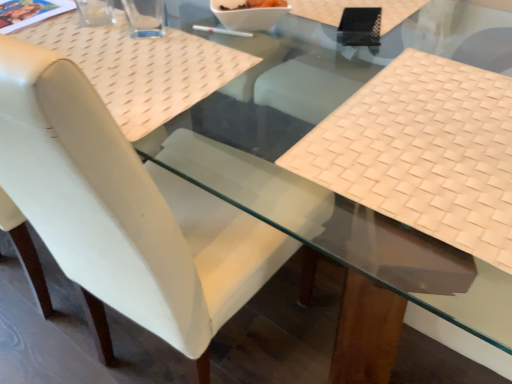
The height and width of the screenshot is (384, 512). Describe the element at coordinates (124, 212) in the screenshot. I see `white leather chair at center` at that location.

The image size is (512, 384). In order to click on transparent glass cup at upper left, the second clear positioned from the right in this screenshot , I will do `click(95, 12)`.

What is the approximate width of beige woven mat at right?

13.31 inches.

You are a GUI agent. You are given a task and a screenshot of the screen. Output one action in this format:
    pyautogui.click(x=<x>, y=<y>)
    Task: Click on the white glossy bowl at center
    The height and width of the screenshot is (384, 512).
    Given the screenshot: What is the action you would take?
    pyautogui.click(x=249, y=13)

Is transparent glass at upper left, the first clear when ordered from right to left, a part of white glossy bowl at center?

Definitely not — transparent glass at upper left, the first clear when ordered from right to left, is not inside white glossy bowl at center.

Looking at this image, are white glossy bowl at center and transparent glass at upper left, the first clear when ordered from right to left, far apart?

No, there isn't a large distance between white glossy bowl at center and transparent glass at upper left, the first clear when ordered from right to left.

Which object is closer to the camera, white glossy bowl at center or transparent glass at upper left, the 2th clear when ordered from left to right?

transparent glass at upper left, the 2th clear when ordered from left to right.

From a real-world perspective, is white glossy bowl at center physically below transparent glass at upper left, the 2th clear when ordered from left to right?

Indeed, from a real-world perspective, white glossy bowl at center is positioned beneath transparent glass at upper left, the 2th clear when ordered from left to right.

Is the position of transparent glass cup at upper left, the second clear positioned from the right, more distant than that of transparent glass at upper left, the 2th clear when ordered from left to right?

Yes, the depth of transparent glass cup at upper left, the second clear positioned from the right, is greater than that of transparent glass at upper left, the 2th clear when ordered from left to right.

Between point (93, 10) and point (164, 25), which one is positioned in front?

The point (164, 25) is more forward.

Can you see transparent glass cup at upper left, marked as the 1th clear in a left-to-right arrangement, touching transparent glass at upper left, the 2th clear when ordered from left to right?

Yes, transparent glass cup at upper left, marked as the 1th clear in a left-to-right arrangement, is with transparent glass at upper left, the 2th clear when ordered from left to right.

Is transparent glass cup at upper left, marked as the 1th clear in a left-to-right arrangement, at the left side of transparent glass at upper left, the 2th clear when ordered from left to right?

Yes, transparent glass cup at upper left, marked as the 1th clear in a left-to-right arrangement, is to the left of transparent glass at upper left, the 2th clear when ordered from left to right.

From the image's perspective, is transparent glass cup at upper left, marked as the 1th clear in a left-to-right arrangement, on white leather chair at center?

Yes, from the image's perspective, transparent glass cup at upper left, marked as the 1th clear in a left-to-right arrangement, is above white leather chair at center.

Between transparent glass cup at upper left, the second clear positioned from the right, and white leather chair at center, which one has smaller size?

With smaller size is transparent glass cup at upper left, the second clear positioned from the right.

Is transparent glass cup at upper left, the second clear positioned from the right, not within white leather chair at center?

Absolutely, transparent glass cup at upper left, the second clear positioned from the right, is external to white leather chair at center.

From the picture: Looking at the image, does white leather chair at center seem bigger or smaller compared to beige woven mat at right?

Clearly, white leather chair at center is larger in size than beige woven mat at right.

From the image's perspective, is white leather chair at center above beige woven mat at right?

Incorrect, from the image's perspective, white leather chair at center is lower than beige woven mat at right.

Locate an element on the screen. The width and height of the screenshot is (512, 384). chair lying on the left of beige woven mat at right is located at coordinates (124, 212).

Is white leather chair at center positioned before beige woven mat at right?

Yes, white leather chair at center is closer to the viewer.

From a real-world perspective, is transparent glass cup at upper left, the second clear positioned from the right, above or below white glossy bowl at center?

transparent glass cup at upper left, the second clear positioned from the right, is situated higher than white glossy bowl at center in the real world.

Considering the sizes of objects transparent glass cup at upper left, marked as the 1th clear in a left-to-right arrangement, and white glossy bowl at center in the image provided, who is shorter, transparent glass cup at upper left, marked as the 1th clear in a left-to-right arrangement, or white glossy bowl at center?

Standing shorter between the two is white glossy bowl at center.

Image resolution: width=512 pixels, height=384 pixels. Find the location of `glass bowl on the right of transparent glass cup at upper left, marked as the 1th clear in a left-to-right arrangement`. glass bowl on the right of transparent glass cup at upper left, marked as the 1th clear in a left-to-right arrangement is located at coordinates (249, 13).

Is transparent glass cup at upper left, marked as the 1th clear in a left-to-right arrangement, thinner than white glossy bowl at center?

Yes, transparent glass cup at upper left, marked as the 1th clear in a left-to-right arrangement, is thinner than white glossy bowl at center.

In the image, is transparent glass at upper left, the 2th clear when ordered from left to right, positioned in front of or behind white glossy bowl at center?

transparent glass at upper left, the 2th clear when ordered from left to right, is in front of white glossy bowl at center.

Identify the location of the 1st clear to the left of the white glossy bowl at center, starting your count from the anchor. pyautogui.click(x=145, y=17).

From a real-world perspective, is transparent glass at upper left, the first clear when ordered from right to left, positioned under white glossy bowl at center based on gravity?

No, from a real-world perspective, transparent glass at upper left, the first clear when ordered from right to left, is not under white glossy bowl at center.

Looking at this image, is transparent glass at upper left, the first clear when ordered from right to left, aimed at white glossy bowl at center?

No, transparent glass at upper left, the first clear when ordered from right to left, is not facing towards white glossy bowl at center.

Is white leather chair at center turned away from transparent glass cup at upper left, marked as the 1th clear in a left-to-right arrangement?

white leather chair at center is not turned away from transparent glass cup at upper left, marked as the 1th clear in a left-to-right arrangement.

Who is smaller, white leather chair at center or transparent glass cup at upper left, marked as the 1th clear in a left-to-right arrangement?

transparent glass cup at upper left, marked as the 1th clear in a left-to-right arrangement.

Does white leather chair at center come in front of transparent glass cup at upper left, the second clear positioned from the right?

Yes, it is.

Based on their positions, is white leather chair at center located to the left or right of transparent glass cup at upper left, marked as the 1th clear in a left-to-right arrangement?

From the image, it's evident that white leather chair at center is to the right of transparent glass cup at upper left, marked as the 1th clear in a left-to-right arrangement.

The height and width of the screenshot is (384, 512). I want to click on glass bowl behind the transparent glass at upper left, the 2th clear when ordered from left to right, so pyautogui.click(x=249, y=13).

This screenshot has width=512, height=384. What are the coordinates of `clear that is on the right side of transparent glass cup at upper left, marked as the 1th clear in a left-to-right arrangement` in the screenshot? It's located at (145, 17).

When comparing their distances from white glossy bowl at center, does transparent glass at upper left, the 2th clear when ordered from left to right, or transparent glass cup at upper left, marked as the 1th clear in a left-to-right arrangement, seem closer?

Among the two, transparent glass at upper left, the 2th clear when ordered from left to right, is located nearer to white glossy bowl at center.

Estimate the real-world distances between objects in this image. Which object is closer to white glossy bowl at center, transparent glass cup at upper left, the second clear positioned from the right, or white plastic chopstick at center?

white plastic chopstick at center is closer to white glossy bowl at center.

Estimate the real-world distances between objects in this image. Which object is closer to white leather chair at center, beige woven mat at right or white glossy bowl at center?

Based on the image, beige woven mat at right appears to be nearer to white leather chair at center.

From the image, which object appears to be farther from transparent glass cup at upper left, the second clear positioned from the right, white leather chair at center or white plastic chopstick at center?

white leather chair at center is further to transparent glass cup at upper left, the second clear positioned from the right.

From the image, which object appears to be farther from beige woven mat at right, white leather chair at center or white glossy bowl at center?

white glossy bowl at center lies further to beige woven mat at right than the other object.

Estimate the real-world distances between objects in this image. Which object is closer to transparent glass cup at upper left, marked as the 1th clear in a left-to-right arrangement, white glossy bowl at center or white plastic chopstick at center?

Based on the image, white plastic chopstick at center appears to be nearer to transparent glass cup at upper left, marked as the 1th clear in a left-to-right arrangement.

Based on their spatial positions, is beige woven mat at right or transparent glass at upper left, the 2th clear when ordered from left to right, further from white leather chair at center?

Among the two, transparent glass at upper left, the 2th clear when ordered from left to right, is located further to white leather chair at center.

When comparing their distances from white glossy bowl at center, does transparent glass at upper left, the 2th clear when ordered from left to right, or beige woven mat at right seem closer?

Among the two, transparent glass at upper left, the 2th clear when ordered from left to right, is located nearer to white glossy bowl at center.

At what (x,y) coordinates should I click in order to perform the action: click on glass bowl located between white leather chair at center and white plastic chopstick at center in the depth direction. Please return your answer as a coordinate pair (x, y). This screenshot has width=512, height=384. Looking at the image, I should click on (249, 13).

Where is `chair between transparent glass at upper left, the 2th clear when ordered from left to right, and beige woven mat at right`? The image size is (512, 384). chair between transparent glass at upper left, the 2th clear when ordered from left to right, and beige woven mat at right is located at coordinates (124, 212).

Locate an element on the screen. glass bowl located between transparent glass at upper left, the first clear when ordered from right to left, and beige woven mat at right in the left-right direction is located at coordinates (249, 13).

Locate an element on the screen. This screenshot has height=384, width=512. chopstick situated between transparent glass cup at upper left, marked as the 1th clear in a left-to-right arrangement, and white glossy bowl at center from left to right is located at coordinates coord(222,31).